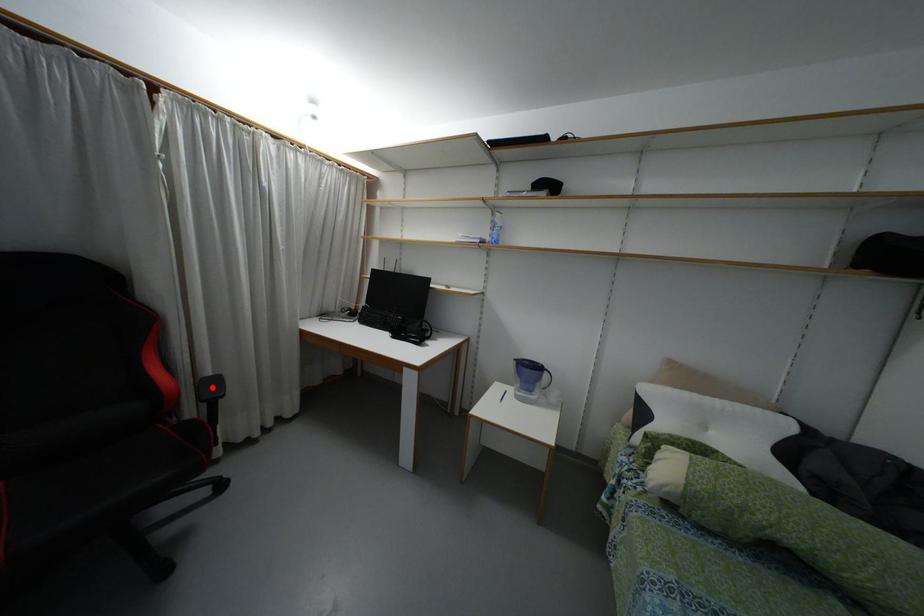
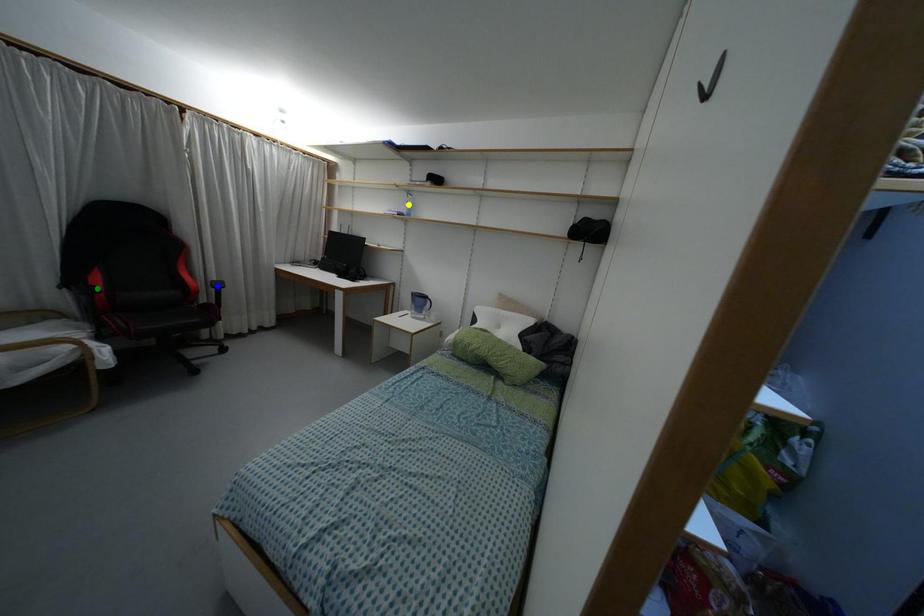
Question: I am providing you with two images of the same scene from different viewpoints. A red point is marked on the first image. You are given multiple points on the second image. Which mark in image 2 goes with the point in image 1?

Choices:
 (A) blue point
 (B) yellow point
 (C) green point

Answer: (A)